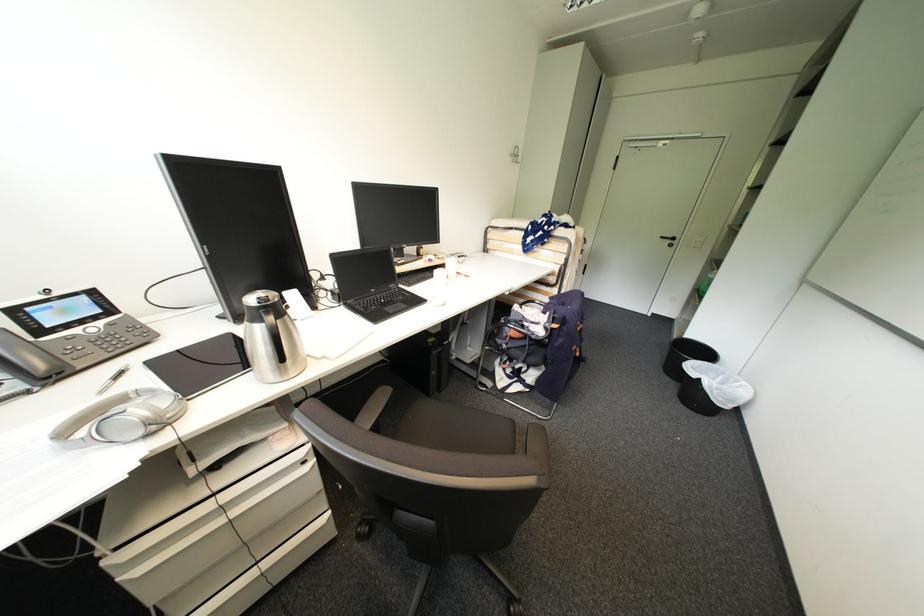
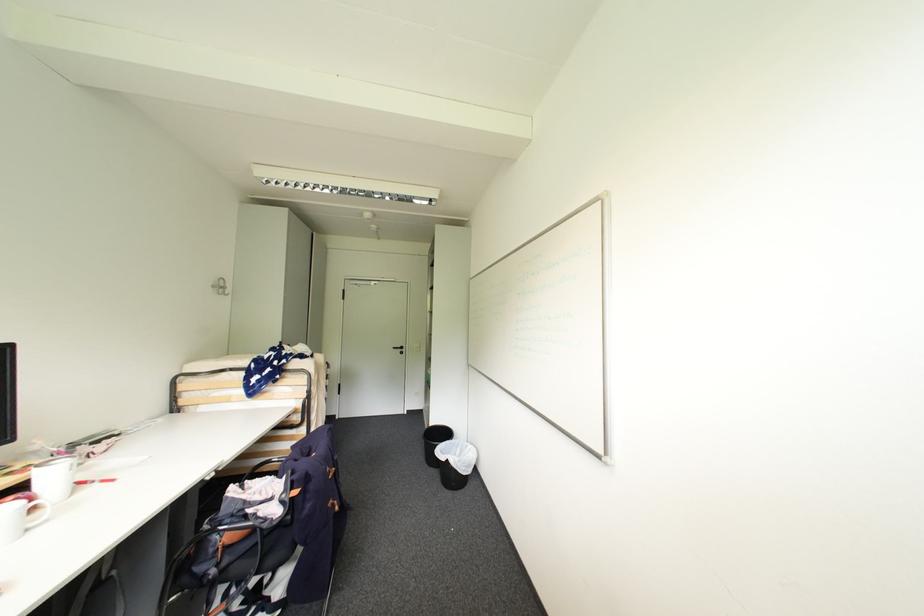
Find the pixel in the second image that matches the point at 517,156 in the first image.

(220, 286)